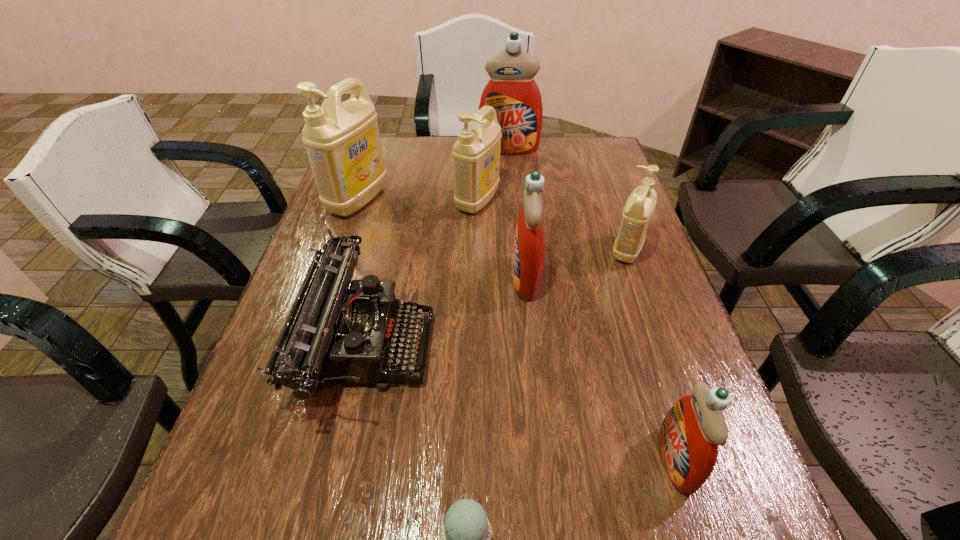
Identify the location of vacant space located on the front surface of the nearest detergent. This screenshot has width=960, height=540. (500, 460).

Where is `vacant area situated 0.300m on the keyboard of the typewriter`? vacant area situated 0.300m on the keyboard of the typewriter is located at coordinates (570, 343).

At what (x,y) coordinates should I click in order to perform the action: click on object situated at the far edge. Please return your answer as a coordinate pair (x, y). The image size is (960, 540). Looking at the image, I should click on (513, 93).

This screenshot has width=960, height=540. I want to click on detergent that is at the left edge, so click(x=342, y=140).

In order to click on typewriter at the left edge in this screenshot , I will do `click(334, 333)`.

At what (x,y) coordinates should I click in order to perform the action: click on free space at the far edge of the desktop. Please return your answer as a coordinate pair (x, y). The height and width of the screenshot is (540, 960). Looking at the image, I should click on (428, 144).

The image size is (960, 540). In the image, there is a desktop. Identify the location of vacant space at the left edge. (279, 335).

This screenshot has height=540, width=960. Identify the location of vacant space at the right edge. (651, 369).

Identify the location of vacant space at the far right corner of the desktop. The image size is (960, 540). (596, 148).

Where is `blank region between the second nearest red detergent and the typewriter`? blank region between the second nearest red detergent and the typewriter is located at coordinates (446, 310).